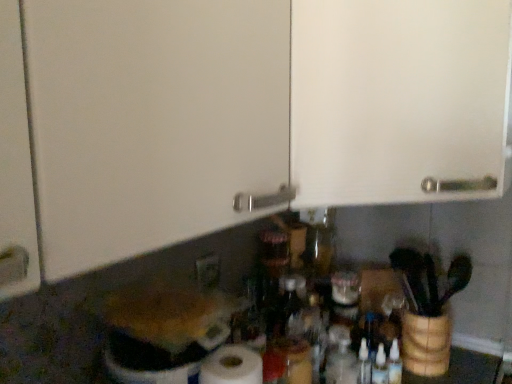
Describe the element at coordinates (208, 271) in the screenshot. The height and width of the screenshot is (384, 512). I see `matte white electric outlet at lower center` at that location.

Measure the distance between white matte paper towel at lower center and camera.

67.80 centimeters.

What is the approximate height of transparent plastic bottle at center?

4.67 inches.

At what (x,y) coordinates should I click in order to perform the action: click on white matte cabinet door at upper center. Please return your answer as a coordinate pair (x, y). Image resolution: width=512 pixels, height=384 pixels. Looking at the image, I should click on (398, 100).

Does transparent plastic bottle at center touch white matte cabinet door at upper center?

There is a gap between transparent plastic bottle at center and white matte cabinet door at upper center.

Considering the relative sizes of transparent plastic bottle at center and white matte cabinet door at upper center in the image provided, is transparent plastic bottle at center taller than white matte cabinet door at upper center?

No, transparent plastic bottle at center is not taller than white matte cabinet door at upper center.

Between transparent plastic bottle at center and white matte cabinet door at upper center, which one is positioned behind?

Positioned behind is transparent plastic bottle at center.

At what (x,y) coordinates should I click in order to perform the action: click on cabinetry that appears above the transparent plastic bottle at center (from the image's perspective). Please return your answer as a coordinate pair (x, y). Looking at the image, I should click on (398, 100).

Find the location of a particular element. paper towel that appears below the matte white electric outlet at lower center (from the image's perspective) is located at coordinates (232, 366).

Looking at the image, does white matte paper towel at lower center seem bigger or smaller compared to matte white electric outlet at lower center?

Considering their sizes, white matte paper towel at lower center takes up more space than matte white electric outlet at lower center.

Who is more distant, white matte paper towel at lower center or matte white electric outlet at lower center?

matte white electric outlet at lower center is behind.

Is matte white electric outlet at lower center surrounded by white matte paper towel at lower center?

No, matte white electric outlet at lower center is not a part of white matte paper towel at lower center.

From the image's perspective, is white matte cabinet door at upper center below transparent plastic bottle at center?

No, from the image's perspective, white matte cabinet door at upper center is not below transparent plastic bottle at center.

Considering the relative positions of white matte cabinet door at upper center and transparent plastic bottle at center in the image provided, is white matte cabinet door at upper center to the left or to the right of transparent plastic bottle at center?

Clearly, white matte cabinet door at upper center is on the left of transparent plastic bottle at center in the image.

The height and width of the screenshot is (384, 512). I want to click on bottle on the right of white matte cabinet door at upper center, so click(x=380, y=367).

Who is shorter, transparent plastic bottle at center or matte white electric outlet at lower center?

With less height is matte white electric outlet at lower center.

Is the depth of transparent plastic bottle at center greater than that of matte white electric outlet at lower center?

No, it is not.

From the image's perspective, which object appears higher, transparent plastic bottle at center or matte white electric outlet at lower center?

From the image's view, matte white electric outlet at lower center is above.

Can you tell me how much transparent plastic bottle at center and matte white electric outlet at lower center differ in facing direction?

0.967 degrees separate the facing orientations of transparent plastic bottle at center and matte white electric outlet at lower center.

Who is shorter, white matte cabinet door at upper center or white matte paper towel at lower center?

Standing shorter between the two is white matte paper towel at lower center.

Looking at this image, can you confirm if white matte cabinet door at upper center is wider than white matte paper towel at lower center?

Correct, the width of white matte cabinet door at upper center exceeds that of white matte paper towel at lower center.

Is white matte cabinet door at upper center closer to camera compared to white matte paper towel at lower center?

Yes.

In the scene shown: Is white matte paper towel at lower center at the back of white matte cabinet door at upper center?

No.

Is point (223, 348) more distant than point (384, 351)?

No, it is in front of (384, 351).

From the picture: Considering the relative sizes of white matte paper towel at lower center and transparent plastic bottle at center in the image provided, is white matte paper towel at lower center taller than transparent plastic bottle at center?

Yes.

From a real-world perspective, between white matte paper towel at lower center and transparent plastic bottle at center, who is vertically higher?

In real-world perspective, white matte paper towel at lower center is above.

How different are the orientations of matte white electric outlet at lower center and white matte cabinet door at upper center in degrees?

matte white electric outlet at lower center and white matte cabinet door at upper center are facing 43.4 degrees away from each other.

From the image's perspective, is matte white electric outlet at lower center located beneath white matte cabinet door at upper center?

Correct, matte white electric outlet at lower center appears lower than white matte cabinet door at upper center in the image.

Are matte white electric outlet at lower center and white matte cabinet door at upper center beside each other?

No.

Is matte white electric outlet at lower center facing towards white matte cabinet door at upper center?

No, matte white electric outlet at lower center does not turn towards white matte cabinet door at upper center.

At what (x,y) coordinates should I click in order to perform the action: click on bottle below the white matte cabinet door at upper center (from the image's perspective). Please return your answer as a coordinate pair (x, y). This screenshot has height=384, width=512. Looking at the image, I should click on (380, 367).

Identify the location of paper towel directly beneath the matte white electric outlet at lower center (from a real-world perspective). The image size is (512, 384). (232, 366).

Based on the photo, which object lies nearer to the anchor point transparent plastic bottle at center, white matte paper towel at lower center or white matte cabinet door at upper center?

white matte paper towel at lower center is closer to transparent plastic bottle at center.

Looking at this image, considering their positions, is white matte cabinet door at upper center positioned closer to matte white electric outlet at lower center than transparent plastic bottle at center?

Based on the image, transparent plastic bottle at center appears to be nearer to matte white electric outlet at lower center.

When comparing their distances from matte white electric outlet at lower center, does transparent plastic bottle at center or white matte cabinet door at upper center seem closer?

Among the two, transparent plastic bottle at center is located nearer to matte white electric outlet at lower center.

Which object lies further to the anchor point transparent plastic bottle at center, matte white electric outlet at lower center or white matte cabinet door at upper center?

Among the two, white matte cabinet door at upper center is located further to transparent plastic bottle at center.

Considering their positions, is transparent plastic bottle at center positioned further to matte white electric outlet at lower center than white matte paper towel at lower center?

Among the two, transparent plastic bottle at center is located further to matte white electric outlet at lower center.

Estimate the real-world distances between objects in this image. Which object is closer to matte white electric outlet at lower center, white matte paper towel at lower center or transparent plastic bottle at center?

white matte paper towel at lower center is closer to matte white electric outlet at lower center.

From the image, which object appears to be farther from white matte cabinet door at upper center, white matte paper towel at lower center or matte white electric outlet at lower center?

Among the two, matte white electric outlet at lower center is located further to white matte cabinet door at upper center.

Estimate the real-world distances between objects in this image. Which object is closer to white matte cabinet door at upper center, white matte paper towel at lower center or transparent plastic bottle at center?

Based on the image, white matte paper towel at lower center appears to be nearer to white matte cabinet door at upper center.

Where is `paper towel between white matte cabinet door at upper center and transparent plastic bottle at center in the up-down direction`? The width and height of the screenshot is (512, 384). paper towel between white matte cabinet door at upper center and transparent plastic bottle at center in the up-down direction is located at coordinates (232, 366).

This screenshot has height=384, width=512. What are the coordinates of `electric outlet between white matte cabinet door at upper center and white matte paper towel at lower center in the vertical direction` in the screenshot? It's located at (208, 271).

Where is `paper towel between matte white electric outlet at lower center and transparent plastic bottle at center`? The height and width of the screenshot is (384, 512). paper towel between matte white electric outlet at lower center and transparent plastic bottle at center is located at coordinates (232, 366).

Image resolution: width=512 pixels, height=384 pixels. I want to click on electric outlet that lies between white matte cabinet door at upper center and transparent plastic bottle at center from top to bottom, so click(208, 271).